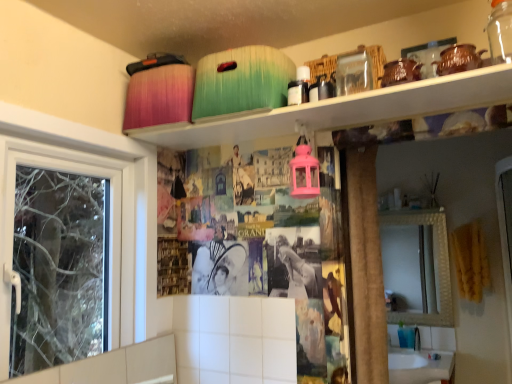
Question: Does transparent glass jar at upper center have a larger size compared to matte plastic containers at upper center?

Choices:
 (A) no
 (B) yes

Answer: (A)

Question: Does transparent glass jar at upper center appear on the right side of matte plastic containers at upper center?

Choices:
 (A) yes
 (B) no

Answer: (A)

Question: Does transparent glass jar at upper center have a greater height compared to matte plastic containers at upper center?

Choices:
 (A) yes
 (B) no

Answer: (A)

Question: Could matte plastic containers at upper center be considered to be inside transparent glass jar at upper center?

Choices:
 (A) no
 (B) yes

Answer: (A)

Question: Does transparent glass jar at upper center touch matte plastic containers at upper center?

Choices:
 (A) yes
 (B) no

Answer: (B)

Question: Looking at the image, does white glossy sink at lower right seem bigger or smaller compared to matte plastic containers at upper center?

Choices:
 (A) big
 (B) small

Answer: (A)

Question: Is white glossy sink at lower right wider or thinner than matte plastic containers at upper center?

Choices:
 (A) thin
 (B) wide

Answer: (B)

Question: In terms of height, does white glossy sink at lower right look taller or shorter compared to matte plastic containers at upper center?

Choices:
 (A) short
 (B) tall

Answer: (B)

Question: From a real-world perspective, is white glossy sink at lower right above or below matte plastic containers at upper center?

Choices:
 (A) below
 (B) above

Answer: (A)

Question: Is matte plastic containers at upper center inside the boundaries of transparent glass jar at upper center, or outside?

Choices:
 (A) outside
 (B) inside

Answer: (A)

Question: From their relative heights in the image, would you say matte plastic containers at upper center is taller or shorter than transparent glass jar at upper center?

Choices:
 (A) tall
 (B) short

Answer: (B)

Question: From a real-world perspective, is matte plastic containers at upper center positioned above or below transparent glass jar at upper center?

Choices:
 (A) above
 (B) below

Answer: (B)

Question: Is matte plastic containers at upper center bigger or smaller than transparent glass jar at upper center?

Choices:
 (A) small
 (B) big

Answer: (B)

Question: From a real-world perspective, relative to transparent glass jar at upper center, is white glossy sink at lower right vertically above or below?

Choices:
 (A) below
 (B) above

Answer: (A)

Question: Looking at the image, does white glossy sink at lower right seem bigger or smaller compared to transparent glass jar at upper center?

Choices:
 (A) small
 (B) big

Answer: (B)